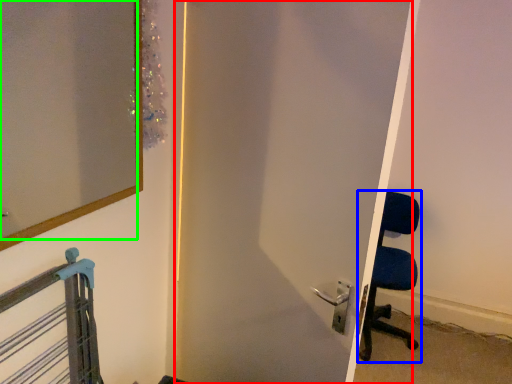
Question: Which object is the farthest from door (highlighted by a red box)? Choose among these: chair (highlighted by a blue box) or mirror (highlighted by a green box).

Choices:
 (A) chair
 (B) mirror

Answer: (A)